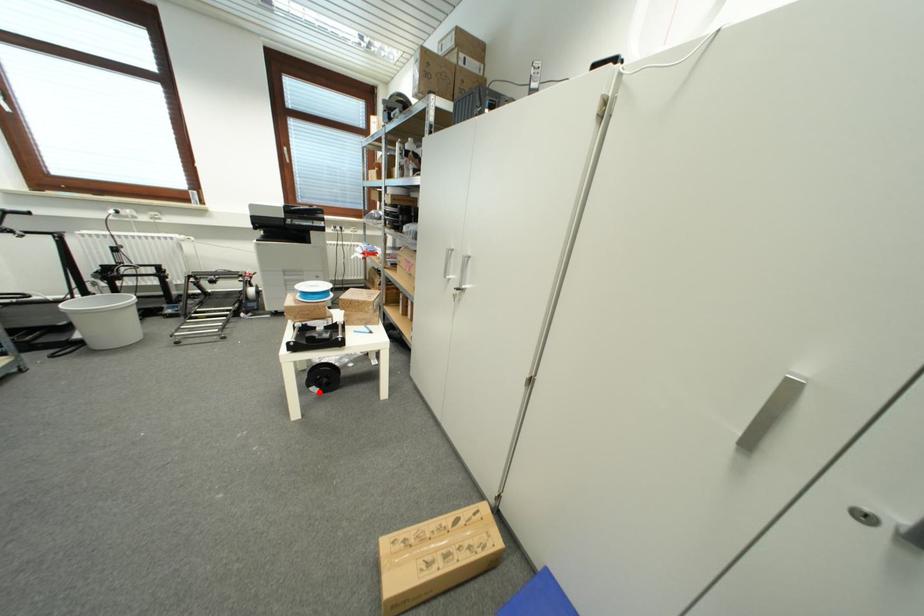
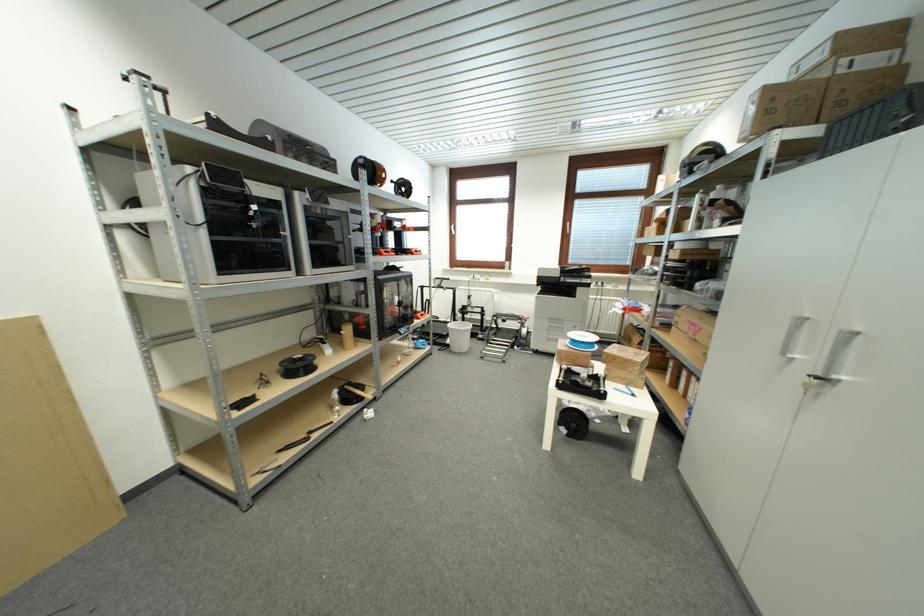
Find the pixel in the second image that matches the highlighted location in the first image.

(568, 432)